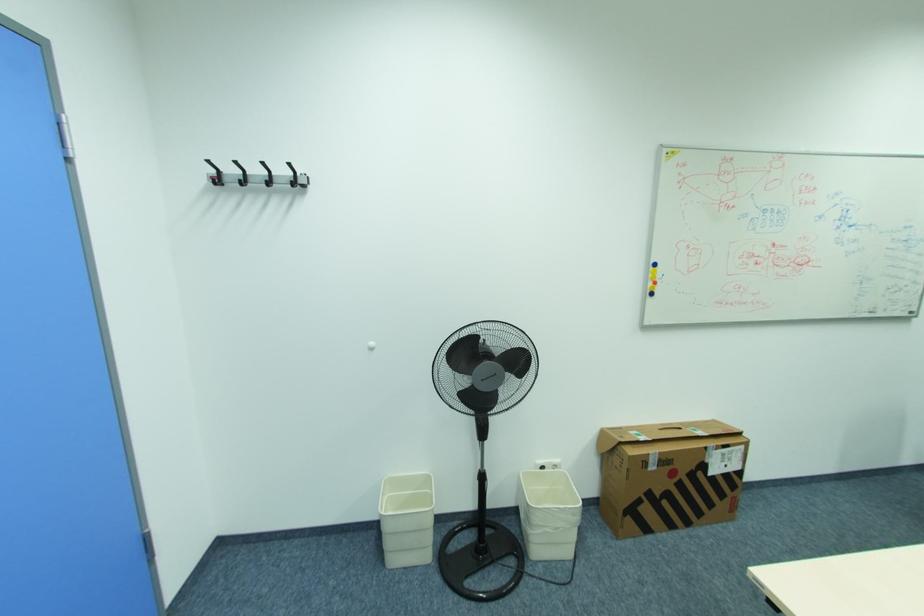
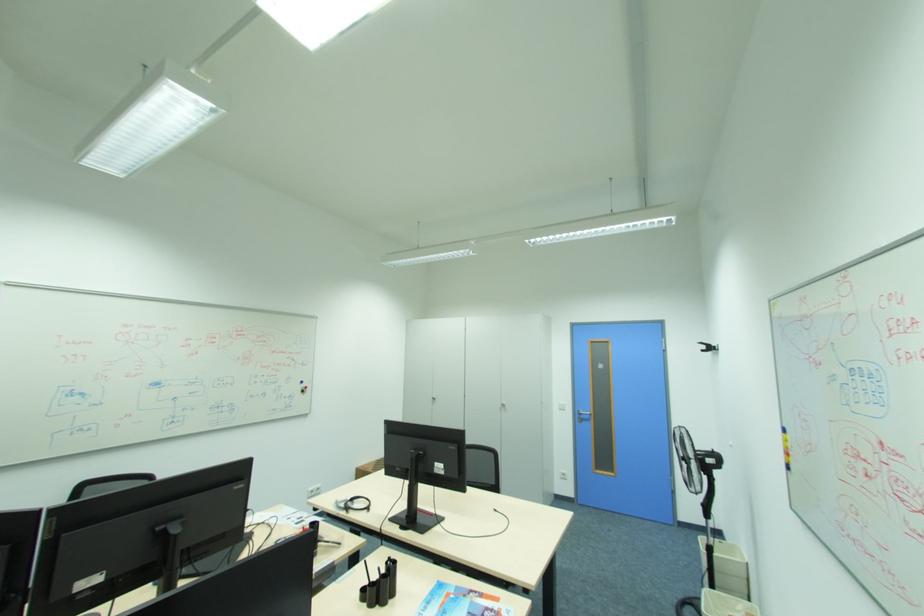
Find the pixel in the second image that matches pixel 663 277 in the first image.

(794, 446)